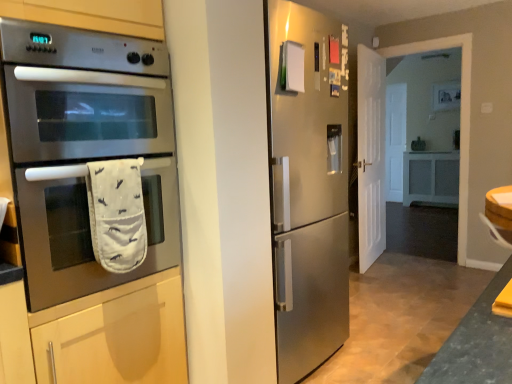
Question: Does stainless steel oven at left have a lesser width compared to white matte door at right?

Choices:
 (A) no
 (B) yes

Answer: (A)

Question: Considering the relative sizes of stainless steel oven at left and white matte door at right in the image provided, is stainless steel oven at left smaller than white matte door at right?

Choices:
 (A) yes
 (B) no

Answer: (B)

Question: Is stainless steel oven at left at the left side of white matte door at right?

Choices:
 (A) no
 (B) yes

Answer: (B)

Question: Does stainless steel oven at left come in front of white matte door at right?

Choices:
 (A) yes
 (B) no

Answer: (A)

Question: Is stainless steel oven at left further to the viewer compared to white matte door at right?

Choices:
 (A) yes
 (B) no

Answer: (B)

Question: From a real-world perspective, is stainless steel oven at left physically below white matte door at right?

Choices:
 (A) yes
 (B) no

Answer: (B)

Question: From the image's perspective, is white matte door at right under stainless steel oven at left?

Choices:
 (A) no
 (B) yes

Answer: (A)

Question: Can you confirm if white matte door at right is smaller than stainless steel oven at left?

Choices:
 (A) no
 (B) yes

Answer: (B)

Question: Is white matte door at right closer to the viewer compared to stainless steel oven at left?

Choices:
 (A) no
 (B) yes

Answer: (A)

Question: Does white matte door at right have a larger size compared to stainless steel oven at left?

Choices:
 (A) yes
 (B) no

Answer: (B)

Question: Is white matte door at right shorter than stainless steel oven at left?

Choices:
 (A) yes
 (B) no

Answer: (B)

Question: Is white matte door at right to the left of stainless steel oven at left from the viewer's perspective?

Choices:
 (A) no
 (B) yes

Answer: (A)

Question: Is white fabric oven mitt at lower left located outside white matte door at right?

Choices:
 (A) yes
 (B) no

Answer: (A)